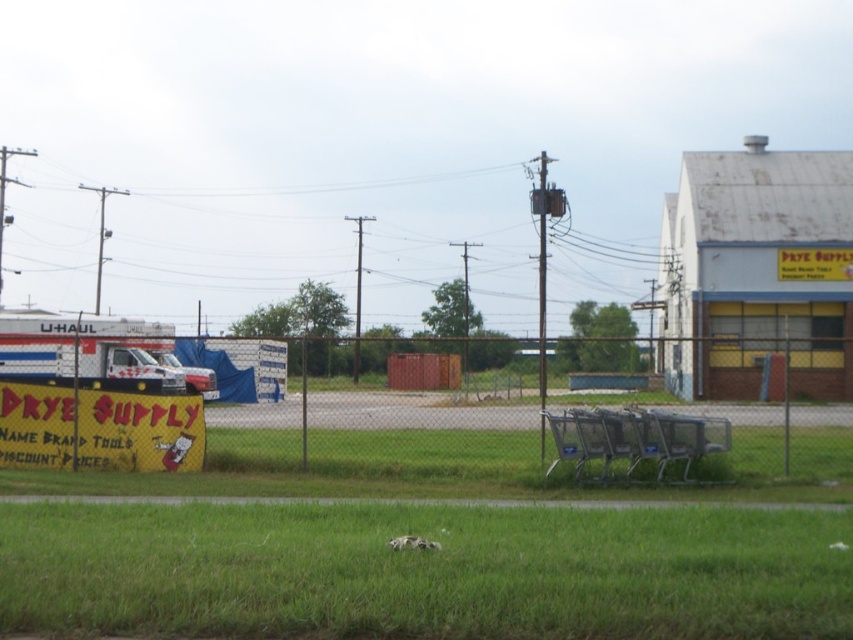
Question: Does green grass at lower center appear over yellow paper sign at left?

Choices:
 (A) yes
 (B) no

Answer: (B)

Question: Which point is closer to the camera taking this photo?

Choices:
 (A) (347, 420)
 (B) (320, 541)

Answer: (B)

Question: Does green grass at lower center have a greater width compared to yellow paper sign at left?

Choices:
 (A) yes
 (B) no

Answer: (B)

Question: Which point is farther to the camera?

Choices:
 (A) yellow paper sign at left
 (B) green grass at lower center
 (C) metallic chain-link fence at center

Answer: (A)

Question: Is green grass at lower center thinner than metallic chain-link fence at center?

Choices:
 (A) no
 (B) yes

Answer: (B)

Question: Estimate the real-world distances between objects in this image. Which object is closer to the yellow paper sign at left?

Choices:
 (A) green grass at lower center
 (B) metallic chain-link fence at center

Answer: (B)